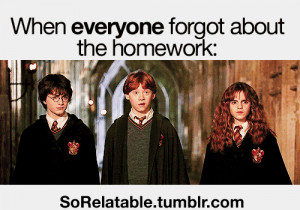
Find the location of a particular element. window is located at coordinates (16, 82).